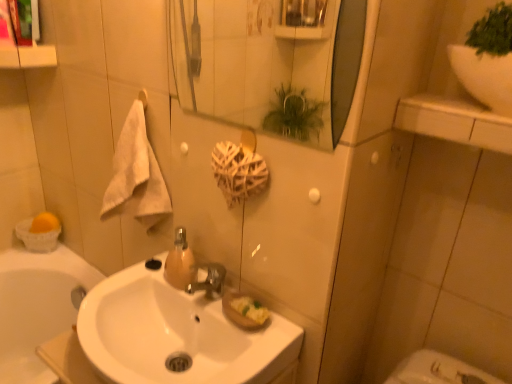
I want to click on vacant space that is to the left of translucent amber glass soap dispenser at center, so click(x=135, y=289).